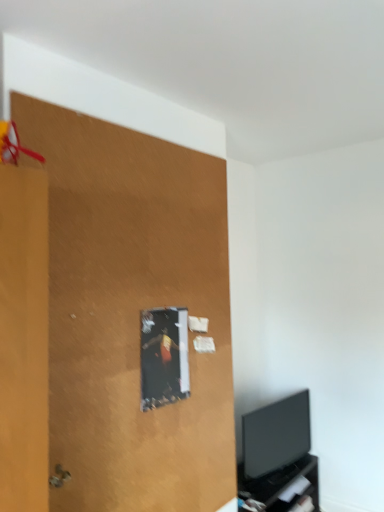
Question: Can you confirm if black glossy tv at lower right is smaller than matte brown plywood at upper left?

Choices:
 (A) yes
 (B) no

Answer: (A)

Question: Could you tell me if black glossy tv at lower right is facing matte brown plywood at upper left?

Choices:
 (A) no
 (B) yes

Answer: (A)

Question: From a real-world perspective, is black glossy tv at lower right on matte brown plywood at upper left?

Choices:
 (A) yes
 (B) no

Answer: (B)

Question: Considering the relative sizes of black glossy tv at lower right and matte brown plywood at upper left in the image provided, is black glossy tv at lower right taller than matte brown plywood at upper left?

Choices:
 (A) yes
 (B) no

Answer: (B)

Question: Does black glossy tv at lower right contain matte brown plywood at upper left?

Choices:
 (A) yes
 (B) no

Answer: (B)

Question: In terms of width, does black matte tv cabinet at lower right look wider or thinner when compared to black glossy tv at lower right?

Choices:
 (A) thin
 (B) wide

Answer: (B)

Question: From a real-world perspective, relative to black glossy tv at lower right, is black matte tv cabinet at lower right vertically above or below?

Choices:
 (A) below
 (B) above

Answer: (A)

Question: In terms of height, does black matte tv cabinet at lower right look taller or shorter compared to black glossy tv at lower right?

Choices:
 (A) tall
 (B) short

Answer: (B)

Question: Is point (311, 493) closer or farther from the camera than point (299, 430)?

Choices:
 (A) closer
 (B) farther

Answer: (A)

Question: In the image, is black matte tv cabinet at lower right positioned in front of or behind matte brown plywood at upper left?

Choices:
 (A) behind
 (B) front

Answer: (A)

Question: Which is correct: black matte tv cabinet at lower right is inside matte brown plywood at upper left, or outside of it?

Choices:
 (A) inside
 (B) outside

Answer: (B)

Question: Is black matte tv cabinet at lower right wider or thinner than matte brown plywood at upper left?

Choices:
 (A) wide
 (B) thin

Answer: (A)

Question: Is black matte tv cabinet at lower right to the left or to the right of matte brown plywood at upper left in the image?

Choices:
 (A) left
 (B) right

Answer: (B)

Question: Relative to matte brown plywood at upper left, is black glossy tv at lower right in front or behind?

Choices:
 (A) front
 (B) behind

Answer: (B)

Question: From a real-world perspective, is black glossy tv at lower right above or below matte brown plywood at upper left?

Choices:
 (A) above
 (B) below

Answer: (B)